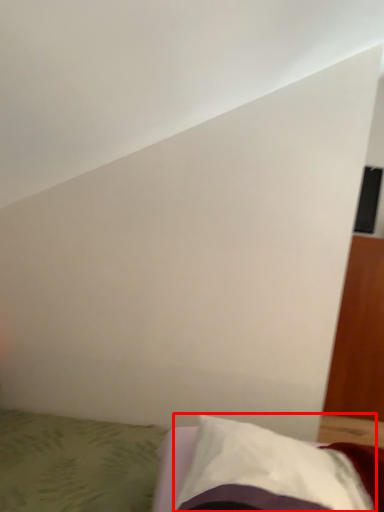
Question: From the image's perspective, where is pillow (annotated by the red box) located relative to bed?

Choices:
 (A) below
 (B) above

Answer: (B)